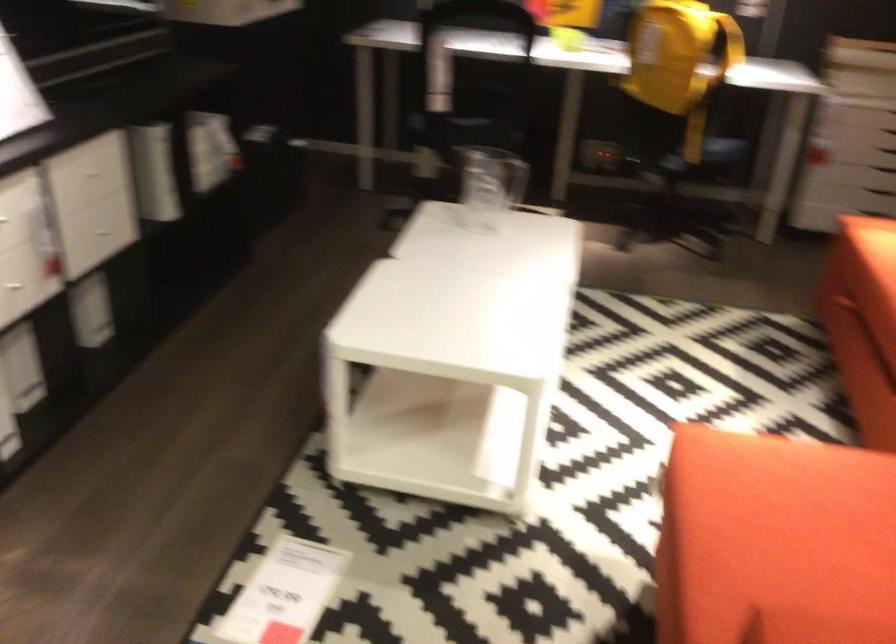
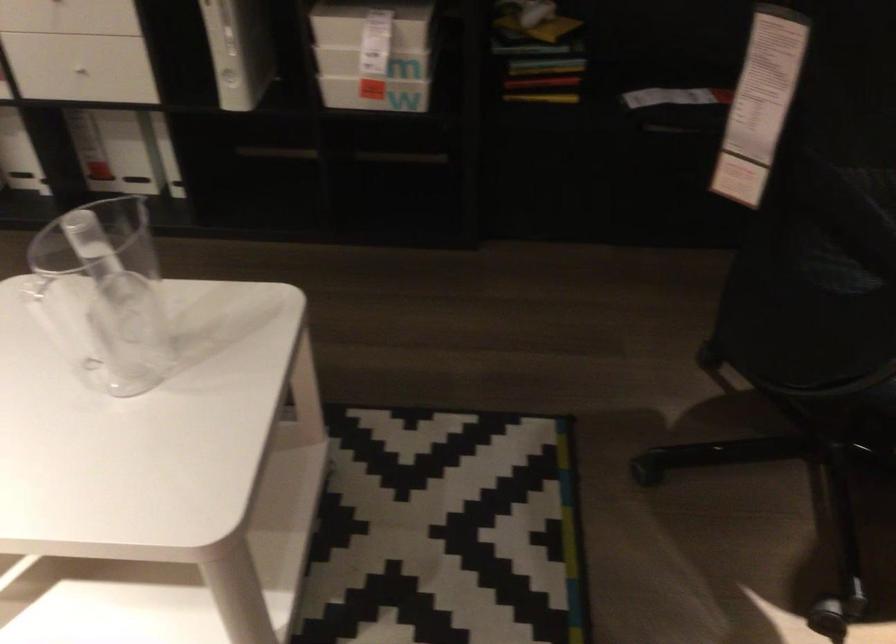
The point at [74,263] is marked in the first image. Where is the corresponding point in the second image?

(75, 77)